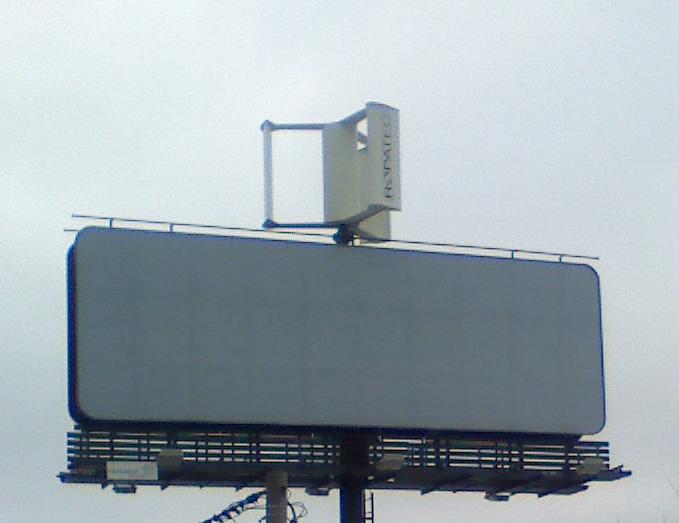
Locate an element on the screen. Image resolution: width=679 pixels, height=523 pixels. lights is located at coordinates (168, 460), (383, 469), (587, 469).